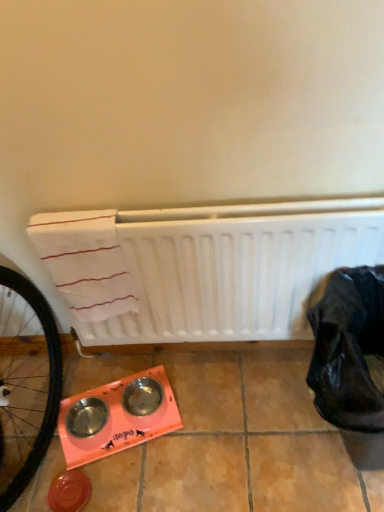
Question: Considering the relative sizes of white matte radiator at center and black fabric bag at lower right in the image provided, is white matte radiator at center taller than black fabric bag at lower right?

Choices:
 (A) no
 (B) yes

Answer: (B)

Question: Does white matte radiator at center come in front of black fabric bag at lower right?

Choices:
 (A) yes
 (B) no

Answer: (B)

Question: From a real-world perspective, is white matte radiator at center physically above black fabric bag at lower right?

Choices:
 (A) yes
 (B) no

Answer: (A)

Question: Considering the relative sizes of white matte radiator at center and black fabric bag at lower right in the image provided, is white matte radiator at center bigger than black fabric bag at lower right?

Choices:
 (A) yes
 (B) no

Answer: (B)

Question: Is black fabric bag at lower right surrounded by white matte radiator at center?

Choices:
 (A) no
 (B) yes

Answer: (A)

Question: Is white matte radiator at center at the left side of black fabric bag at lower right?

Choices:
 (A) yes
 (B) no

Answer: (A)

Question: Does black fabric bag at lower right appear on the left side of white matte radiator at center?

Choices:
 (A) no
 (B) yes

Answer: (A)

Question: Can you confirm if black fabric bag at lower right is shorter than white matte radiator at center?

Choices:
 (A) yes
 (B) no

Answer: (A)

Question: Is black fabric bag at lower right closer to the viewer compared to white matte radiator at center?

Choices:
 (A) yes
 (B) no

Answer: (A)

Question: Would you say black fabric bag at lower right is a long distance from white matte radiator at center?

Choices:
 (A) yes
 (B) no

Answer: (B)

Question: From the image's perspective, is black fabric bag at lower right located beneath white matte radiator at center?

Choices:
 (A) yes
 (B) no

Answer: (A)

Question: Does black fabric bag at lower right appear on the right side of white matte radiator at center?

Choices:
 (A) no
 (B) yes

Answer: (B)

Question: Does point (337, 414) appear closer or farther from the camera than point (104, 340)?

Choices:
 (A) farther
 (B) closer

Answer: (B)